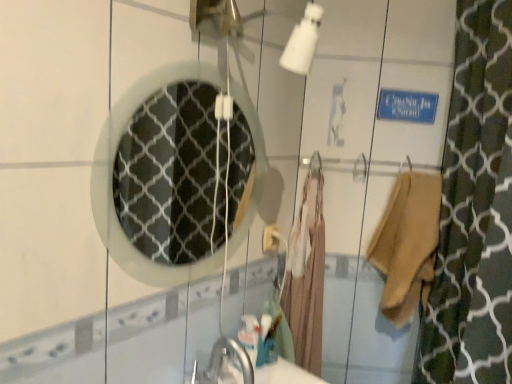
The image size is (512, 384). What do you see at coordinates (169, 173) in the screenshot?
I see `white textured mirror at center` at bounding box center [169, 173].

The image size is (512, 384). I want to click on beige fabric bathrobe at center, so click(306, 278).

From the image's perspective, which object appears higher, beige cotton robe at right or beige fabric bathrobe at center?

From the image's view, beige cotton robe at right is above.

Is beige cotton robe at right wider or thinner than beige fabric bathrobe at center?

In the image, beige cotton robe at right appears to be wider than beige fabric bathrobe at center.

Would you say beige cotton robe at right is a long distance from beige fabric bathrobe at center?

beige cotton robe at right is near beige fabric bathrobe at center, not far away.

Who is shorter, white textured mirror at center or beige fabric bathrobe at center?

With less height is white textured mirror at center.

From the image's perspective, is white textured mirror at center over beige fabric bathrobe at center?

Yes.

Is white textured mirror at center smaller than beige fabric bathrobe at center?

Correct, white textured mirror at center occupies less space than beige fabric bathrobe at center.

Is point (122, 160) closer to camera compared to point (316, 259)?

No.

Does beige fabric bathrobe at center have a smaller size compared to white textured mirror at center?

Actually, beige fabric bathrobe at center might be larger than white textured mirror at center.

How distant is beige fabric bathrobe at center from white textured mirror at center?

A distance of 26.97 inches exists between beige fabric bathrobe at center and white textured mirror at center.

Based on the photo, from the image's perspective, between beige fabric bathrobe at center and white textured mirror at center, who is located below?

beige fabric bathrobe at center.

Is beige fabric bathrobe at center inside the boundaries of white textured mirror at center, or outside?

beige fabric bathrobe at center exists outside the volume of white textured mirror at center.

Can you confirm if white textured mirror at center is wider than beige cotton robe at right?

No.

How different are the orientations of white textured mirror at center and beige cotton robe at right in degrees?

white textured mirror at center and beige cotton robe at right are facing 53 degrees away from each other.

From a real-world perspective, is white textured mirror at center physically below beige cotton robe at right?

No.

Which is in front, point (309, 178) or point (432, 212)?

The point (432, 212) is in front.

From a real-world perspective, between beige fabric bathrobe at center and beige cotton robe at right, who is vertically higher?

From a 3D spatial view, beige cotton robe at right is above.

Is beige fabric bathrobe at center inside or outside of beige cotton robe at right?

beige fabric bathrobe at center is outside beige cotton robe at right.

Could you tell me if beige cotton robe at right is facing white textured mirror at center?

No, beige cotton robe at right is not oriented towards white textured mirror at center.

Does beige cotton robe at right appear on the left side of white textured mirror at center?

In fact, beige cotton robe at right is to the right of white textured mirror at center.

Which is closer to the camera, (392, 287) or (138, 172)?

Point (392, 287) appears to be closer to the viewer than point (138, 172).

How far apart are beige cotton robe at right and white textured mirror at center?

beige cotton robe at right and white textured mirror at center are 36.90 inches apart from each other.

Where is `bathrobe that appears below the beige cotton robe at right (from the image's perspective)`? This screenshot has height=384, width=512. bathrobe that appears below the beige cotton robe at right (from the image's perspective) is located at coordinates click(306, 278).

This screenshot has height=384, width=512. Identify the location of mirror in front of the beige fabric bathrobe at center. (169, 173).

When comparing their distances from beige fabric bathrobe at center, does beige cotton robe at right or white textured mirror at center seem further?

white textured mirror at center is further to beige fabric bathrobe at center.

Estimate the real-world distances between objects in this image. Which object is further from beige cotton robe at right, beige fabric bathrobe at center or white textured mirror at center?

white textured mirror at center is further to beige cotton robe at right.

Looking at the image, which one is located further to white textured mirror at center, beige fabric bathrobe at center or beige cotton robe at right?

Based on the image, beige cotton robe at right appears to be further to white textured mirror at center.

Which object lies nearer to the anchor point beige fabric bathrobe at center, white textured mirror at center or beige cotton robe at right?

beige cotton robe at right is closer to beige fabric bathrobe at center.

From the image, which object appears to be farther from white textured mirror at center, beige cotton robe at right or beige fabric bathrobe at center?

beige cotton robe at right lies further to white textured mirror at center than the other object.

Looking at the image, which one is located further to beige cotton robe at right, white textured mirror at center or beige fabric bathrobe at center?

Based on the image, white textured mirror at center appears to be further to beige cotton robe at right.

I want to click on bathrobe situated between white textured mirror at center and beige cotton robe at right from left to right, so click(306, 278).